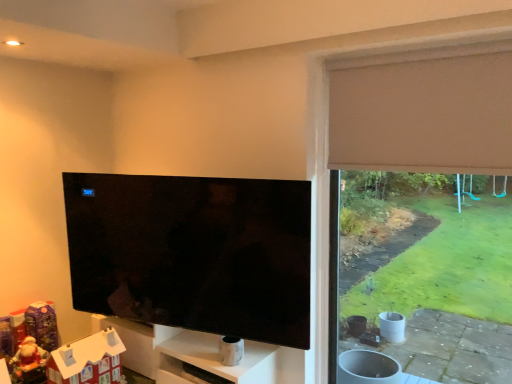
Question: Can you confirm if beige fabric window frame at right is shorter than beige fabric curtain at upper right?

Choices:
 (A) yes
 (B) no

Answer: (B)

Question: From the image's perspective, is beige fabric window frame at right under beige fabric curtain at upper right?

Choices:
 (A) yes
 (B) no

Answer: (A)

Question: Would you say beige fabric window frame at right is a long distance from beige fabric curtain at upper right?

Choices:
 (A) no
 (B) yes

Answer: (A)

Question: Considering the relative sizes of beige fabric window frame at right and beige fabric curtain at upper right in the image provided, is beige fabric window frame at right taller than beige fabric curtain at upper right?

Choices:
 (A) no
 (B) yes

Answer: (B)

Question: Is beige fabric window frame at right oriented towards beige fabric curtain at upper right?

Choices:
 (A) no
 (B) yes

Answer: (B)

Question: From a real-world perspective, does beige fabric window frame at right stand above beige fabric curtain at upper right?

Choices:
 (A) no
 (B) yes

Answer: (A)

Question: From the image's perspective, would you say beige fabric curtain at upper right is shown under beige fabric window frame at right?

Choices:
 (A) no
 (B) yes

Answer: (A)

Question: Considering the relative sizes of beige fabric curtain at upper right and beige fabric window frame at right in the image provided, is beige fabric curtain at upper right thinner than beige fabric window frame at right?

Choices:
 (A) yes
 (B) no

Answer: (A)

Question: From a real-world perspective, is beige fabric curtain at upper right on beige fabric window frame at right?

Choices:
 (A) no
 (B) yes

Answer: (B)

Question: Are beige fabric curtain at upper right and beige fabric window frame at right located far from each other?

Choices:
 (A) no
 (B) yes

Answer: (A)

Question: Is beige fabric curtain at upper right with beige fabric window frame at right?

Choices:
 (A) yes
 (B) no

Answer: (A)

Question: Is beige fabric window frame at right located within beige fabric curtain at upper right?

Choices:
 (A) yes
 (B) no

Answer: (B)

Question: Is matte black tv at center next to white cardboard house at lower left?

Choices:
 (A) no
 (B) yes

Answer: (A)